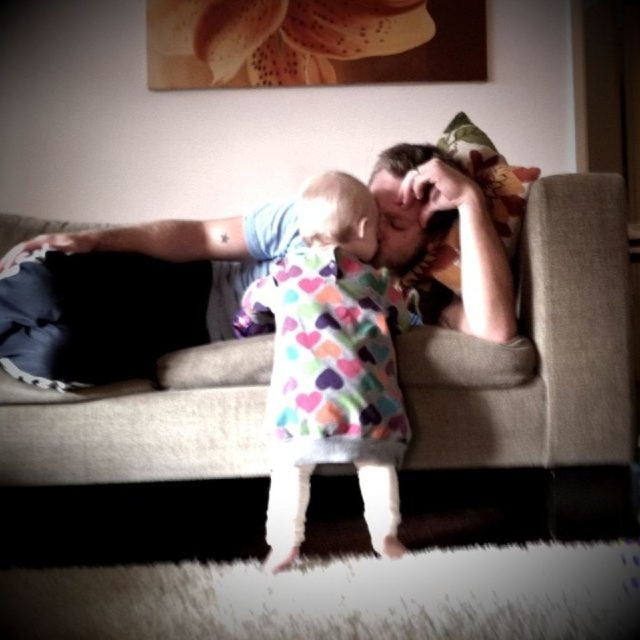
Question: Does beige fabric couch at center come in front of matte blue shirt at center?

Choices:
 (A) yes
 (B) no

Answer: (B)

Question: Is beige fabric couch at center positioned behind multicolored heart-patterned dress at center?

Choices:
 (A) no
 (B) yes

Answer: (B)

Question: Which object is closer to the camera taking this photo?

Choices:
 (A) matte blue shirt at center
 (B) beige fabric couch at center
 (C) multicolored heart-patterned dress at center

Answer: (C)

Question: Which point is farther to the camera?

Choices:
 (A) beige fabric couch at center
 (B) matte blue shirt at center
 (C) multicolored heart-patterned dress at center

Answer: (A)

Question: Which point appears farthest from the camera in this image?

Choices:
 (A) (616, 218)
 (B) (104, 380)

Answer: (A)

Question: Is beige fabric couch at center smaller than multicolored heart-patterned dress at center?

Choices:
 (A) no
 (B) yes

Answer: (A)